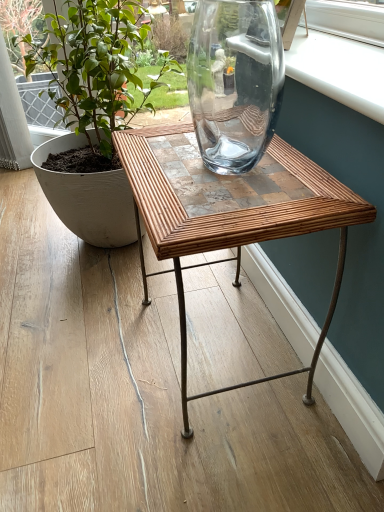
Locate an element on the screen. The width and height of the screenshot is (384, 512). free space to the left of green matte plant at left is located at coordinates click(23, 222).